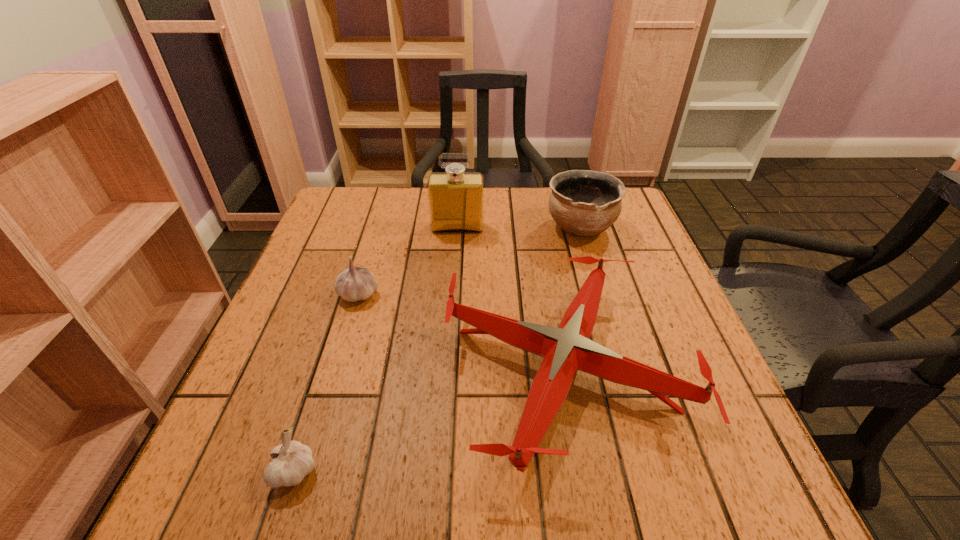
Find the location of `vacant space at the near edge of the desktop`. vacant space at the near edge of the desktop is located at coordinates (404, 502).

Where is `vacant region at the left edge of the desktop`? This screenshot has height=540, width=960. vacant region at the left edge of the desktop is located at coordinates (289, 328).

Identify the location of vacant space at the right edge of the desktop. (654, 268).

Locate an element on the screen. This screenshot has height=540, width=960. vacant space at the far left corner is located at coordinates click(361, 227).

Identify the location of vacant area at the near right corner. The image size is (960, 540). (663, 462).

Find the location of `free space between the pottery and the taller garlic`. free space between the pottery and the taller garlic is located at coordinates (469, 261).

You are a GUI agent. You are given a task and a screenshot of the screen. Output one action in this format:
    pyautogui.click(x=<x>, y=<y>)
    Task: Click on the vacant space in between the tallest object and the nearer garlic
    This screenshot has width=960, height=540.
    Given the screenshot: What is the action you would take?
    pyautogui.click(x=376, y=349)

The height and width of the screenshot is (540, 960). I want to click on free space between the taller garlic and the tallest object, so pyautogui.click(x=408, y=261).

Where is `unoccupied area between the nearer garlic and the perfume`? This screenshot has height=540, width=960. unoccupied area between the nearer garlic and the perfume is located at coordinates (376, 349).

Locate an element on the screen. This screenshot has width=960, height=540. free space between the nearer garlic and the farther garlic is located at coordinates (326, 383).